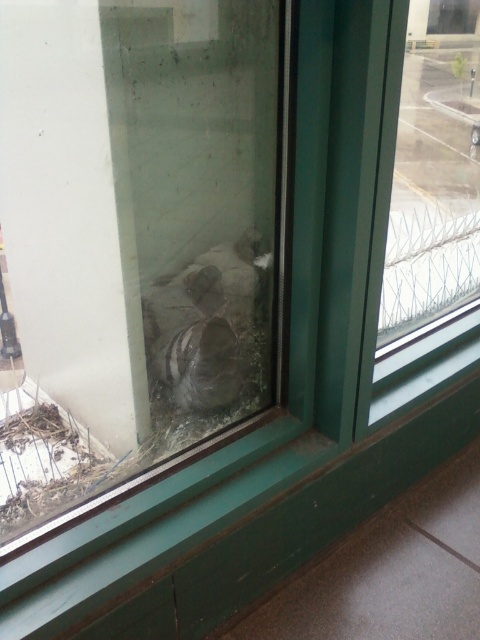
Is point (408, 113) closer to camera compared to point (219, 324)?

No, it is not.

In order to click on transparent glass window at center in this screenshot , I will do `click(423, 202)`.

Between transparent glass door at center and transparent glass window at center, which one appears on the right side from the viewer's perspective?

Positioned to the right is transparent glass window at center.

Which is above, transparent glass door at center or transparent glass window at center?

transparent glass window at center is above.

Does point (49, 490) lie in front of point (454, 96)?

Yes, it is.

You are a GUI agent. You are given a task and a screenshot of the screen. Output one action in this format:
    pyautogui.click(x=<x>, y=<y>)
    Task: Click on the transparent glass door at center
    The image size is (480, 640).
    Given the screenshot: What is the action you would take?
    pyautogui.click(x=135, y=241)

What do you see at coordinates (135, 241) in the screenshot? I see `transparent glass door at center` at bounding box center [135, 241].

At what (x,y) coordinates should I click in order to perform the action: click on transparent glass door at center. Please return your answer as a coordinate pair (x, y). Image resolution: width=480 pixels, height=640 pixels. Looking at the image, I should click on (135, 241).

Is point (54, 413) more distant than point (166, 352)?

Yes, point (54, 413) is farther from viewer.

Locate an element on the screen. The image size is (480, 640). transparent glass door at center is located at coordinates (135, 241).